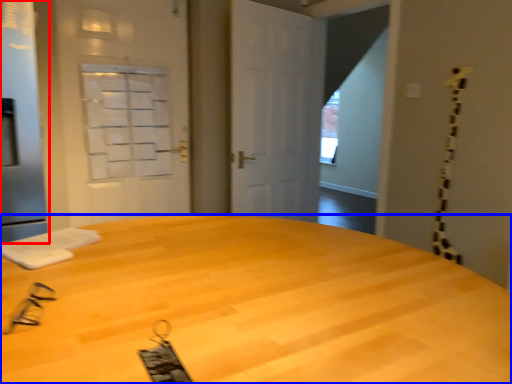
Question: Which object is further to the camera taking this photo, screen door (highlighted by a red box) or desk (highlighted by a blue box)?

Choices:
 (A) screen door
 (B) desk

Answer: (A)